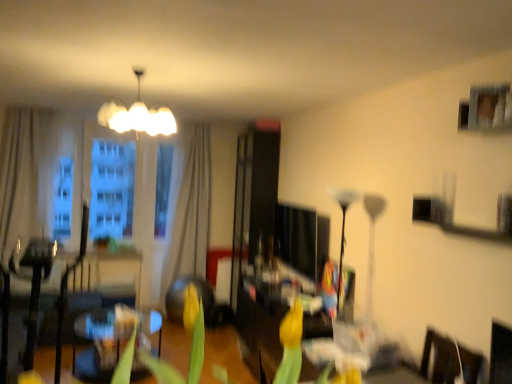
Question: Is yellow matte tulip at center oriented towards black glass floor lamp at center, which is the 2th lamp in top-to-bottom order?

Choices:
 (A) no
 (B) yes

Answer: (A)

Question: Is black glass floor lamp at center, which is the 2th lamp from left to right, surrounded by yellow matte tulip at center?

Choices:
 (A) yes
 (B) no

Answer: (B)

Question: Is yellow matte tulip at center positioned with its back to black glass floor lamp at center, which is the 2th lamp in top-to-bottom order?

Choices:
 (A) no
 (B) yes

Answer: (A)

Question: Is yellow matte tulip at center thinner than black glass floor lamp at center, placed as the 1th lamp when sorted from bottom to top?

Choices:
 (A) no
 (B) yes

Answer: (A)

Question: Can you confirm if yellow matte tulip at center is bigger than black glass floor lamp at center, placed as the 1th lamp when sorted from bottom to top?

Choices:
 (A) yes
 (B) no

Answer: (B)

Question: Is yellow matte tulip at center completely or partially outside of black glass floor lamp at center, which is the 2th lamp in top-to-bottom order?

Choices:
 (A) yes
 (B) no

Answer: (A)

Question: Can you confirm if black glass floor lamp at center, which is the 2th lamp from left to right, is smaller than white fabric curtain at center, arranged as the first curtain when viewed from the back?

Choices:
 (A) no
 (B) yes

Answer: (B)

Question: Is white fabric curtain at center, the first curtain positioned from the right, completely or partially inside black glass floor lamp at center, placed as the 1th lamp when sorted from bottom to top?

Choices:
 (A) yes
 (B) no

Answer: (B)

Question: From the image's perspective, does black glass floor lamp at center, which is the 1th lamp in right-to-left order, appear higher than white fabric curtain at center, the 2th curtain positioned from the front?

Choices:
 (A) yes
 (B) no

Answer: (B)

Question: From the image's perspective, does black glass floor lamp at center, placed as the 1th lamp when sorted from bottom to top, appear lower than white fabric curtain at center, arranged as the first curtain when viewed from the back?

Choices:
 (A) yes
 (B) no

Answer: (A)

Question: From a real-world perspective, is black glass floor lamp at center, which is the 2th lamp from left to right, on top of white fabric curtain at center, the first curtain positioned from the right?

Choices:
 (A) no
 (B) yes

Answer: (A)

Question: Can we say black glass floor lamp at center, placed as the 1th lamp when sorted from bottom to top, lies outside white fabric curtain at center, the 2th curtain positioned from the front?

Choices:
 (A) yes
 (B) no

Answer: (A)

Question: Can you confirm if dark brown leather armchair at left is thinner than white glossy chandelier at upper center, the 1th lamp from the top?

Choices:
 (A) no
 (B) yes

Answer: (A)